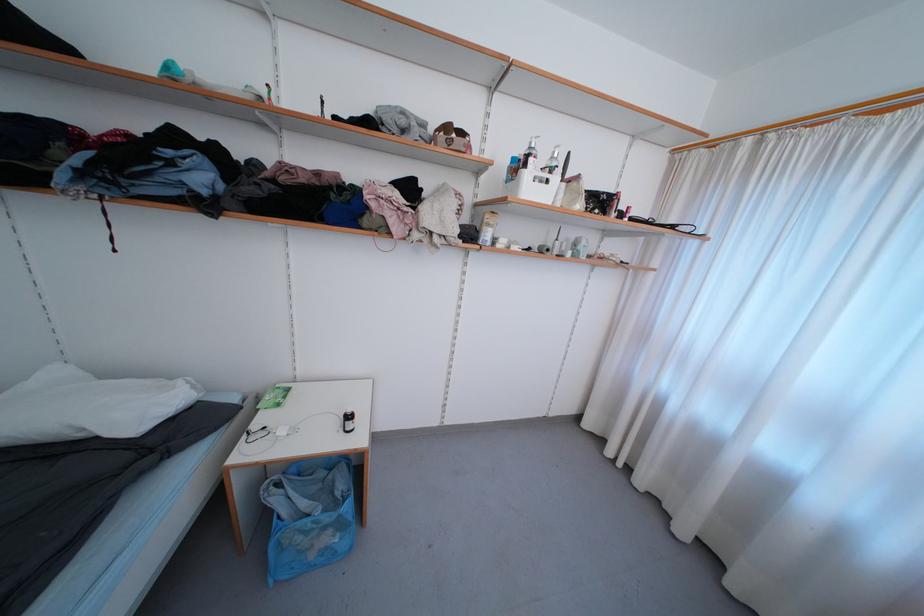
Where is `white phone charger`? The image size is (924, 616). white phone charger is located at coordinates (263, 437).